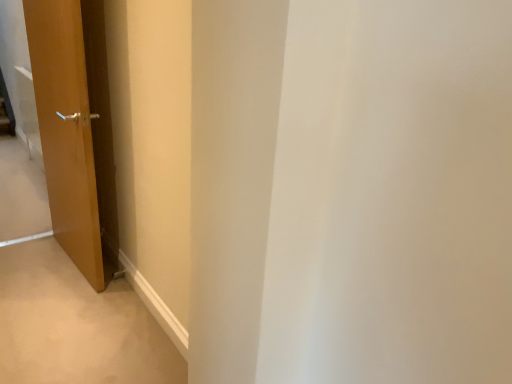
Question: Is matte wood door at left completely or partially outside of brown wood door at lower left?

Choices:
 (A) no
 (B) yes

Answer: (B)

Question: From a real-world perspective, is matte wood door at left under brown wood door at lower left?

Choices:
 (A) yes
 (B) no

Answer: (B)

Question: Can brown wood door at lower left be found inside matte wood door at left?

Choices:
 (A) no
 (B) yes

Answer: (A)

Question: Can you confirm if matte wood door at left is shorter than brown wood door at lower left?

Choices:
 (A) yes
 (B) no

Answer: (B)

Question: Is there a large distance between matte wood door at left and brown wood door at lower left?

Choices:
 (A) yes
 (B) no

Answer: (B)

Question: Is matte wood door at left oriented towards brown wood door at lower left?

Choices:
 (A) yes
 (B) no

Answer: (A)

Question: From the image's perspective, does brown wood door at lower left appear lower than matte wood door at left?

Choices:
 (A) yes
 (B) no

Answer: (A)

Question: Considering the relative sizes of brown wood door at lower left and matte wood door at left in the image provided, is brown wood door at lower left taller than matte wood door at left?

Choices:
 (A) no
 (B) yes

Answer: (A)

Question: Can you confirm if brown wood door at lower left is shorter than matte wood door at left?

Choices:
 (A) no
 (B) yes

Answer: (B)

Question: Is brown wood door at lower left smaller than matte wood door at left?

Choices:
 (A) no
 (B) yes

Answer: (B)

Question: Does brown wood door at lower left touch matte wood door at left?

Choices:
 (A) no
 (B) yes

Answer: (A)

Question: From the image's perspective, would you say brown wood door at lower left is positioned over matte wood door at left?

Choices:
 (A) yes
 (B) no

Answer: (B)

Question: Is matte wood door at left wider or thinner than brown wood door at lower left?

Choices:
 (A) wide
 (B) thin

Answer: (B)